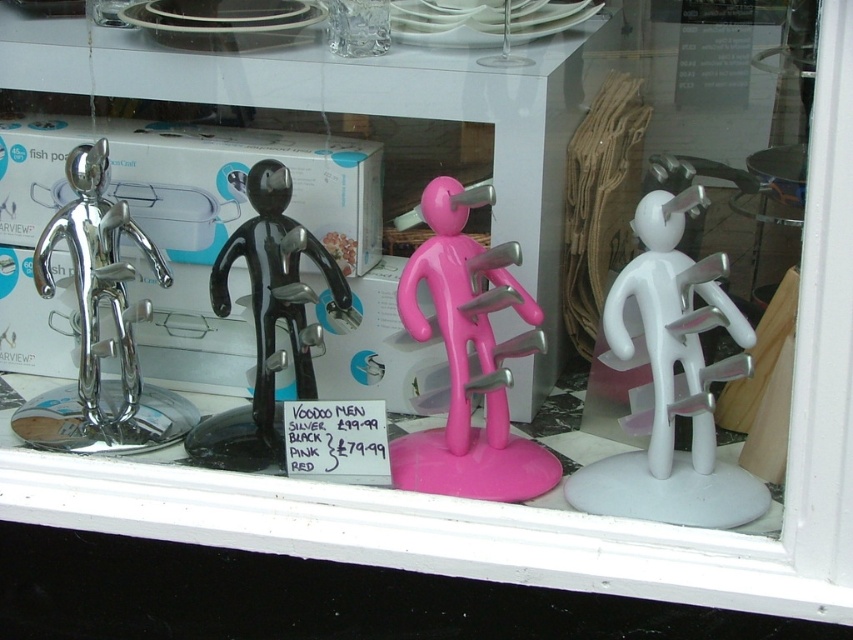
You are a customer in a store and want to buy the pink glossy mannequin at center. The store has a rule that you must be within 4 feet to scan an item. Can you scan the item from your current position?

The distance between you and the pink glossy mannequin at center is 4.27 feet, which is slightly more than the 4 feet requirement. Therefore, you need to move closer to scan it.

You are a customer looking at the display window and want to buy the white plastic figure at center and the black glossy voodoo man at center. However, you notice the price tag is only in front of the pink figure. Can you determine which of the two figures you want is closer to you?

The white plastic figure at center is in front of the black glossy voodoo man at center, so the white plastic figure at center is closer to you.